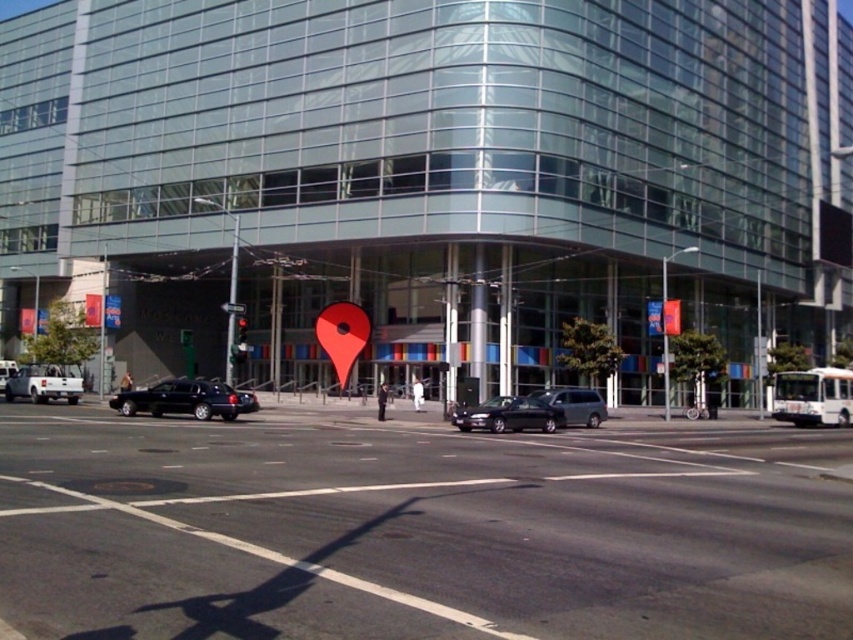
You are navigating a delivery drone that needs to fly from the point at coordinates point (590, 426) to the point at coordinates point (236, 305). Considering the building in front of the second point, will your path be blocked?

Point (590, 426) is in front of point (236, 305), so the path from point (590, 426) to point (236, 305) would be blocked by the building located in front of the latter point.

You are a pedestrian standing at the crosswalk near the building. You see the slate gray van at center and the metallic reflective traffic sign at center. Which object is closer to the ground?

The slate gray van at center is located below the metallic reflective traffic sign at center, so it is closer to the ground.

You are a pedestrian standing at the red glass traffic light at center. You want to cross the street to reach the white matte truck at lower left. Is the truck located in a direction that requires you to go towards the building or away from it?

The white matte truck at lower left is below the red glass traffic light at center, meaning it is positioned further down the street in the direction away from the building. To reach it, you would need to walk away from the building towards the truck.